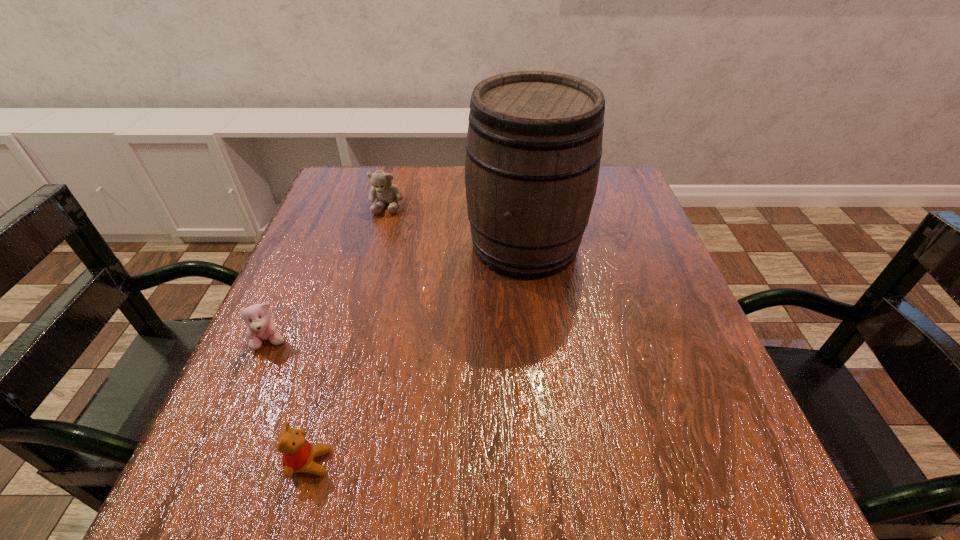
This screenshot has width=960, height=540. In the image, there is a desktop. Find the location of `free space at the far right corner`. free space at the far right corner is located at coordinates (626, 186).

In the image, there is a desktop. Identify the location of vacant space at the near right corner. The height and width of the screenshot is (540, 960). point(721,505).

The image size is (960, 540). Find the location of `vacant area that lies between the farthest teddy bear and the second nearest teddy bear`. vacant area that lies between the farthest teddy bear and the second nearest teddy bear is located at coordinates (328, 273).

Locate an element on the screen. This screenshot has width=960, height=540. free space between the third farthest object and the nearest object is located at coordinates (290, 402).

Find the location of `unoccupied position between the nearest teddy bear and the farthest teddy bear`. unoccupied position between the nearest teddy bear and the farthest teddy bear is located at coordinates (348, 334).

Locate an element on the screen. Image resolution: width=960 pixels, height=540 pixels. vacant space that's between the nearest teddy bear and the wine bucket is located at coordinates (418, 354).

Locate an element on the screen. This screenshot has width=960, height=540. vacant region between the rightmost object and the farthest teddy bear is located at coordinates (456, 225).

Image resolution: width=960 pixels, height=540 pixels. In order to click on free space between the farthest teddy bear and the tallest object in this screenshot , I will do `click(456, 225)`.

You are a GUI agent. You are given a task and a screenshot of the screen. Output one action in this format:
    pyautogui.click(x=<x>, y=<y>)
    Task: Click on the vacant space in between the nearest teddy bear and the second nearest teddy bear
    The width and height of the screenshot is (960, 540).
    Given the screenshot: What is the action you would take?
    pyautogui.click(x=290, y=402)

Find the location of a particular element. empty location between the nearest teddy bear and the rightmost object is located at coordinates [x=418, y=354].